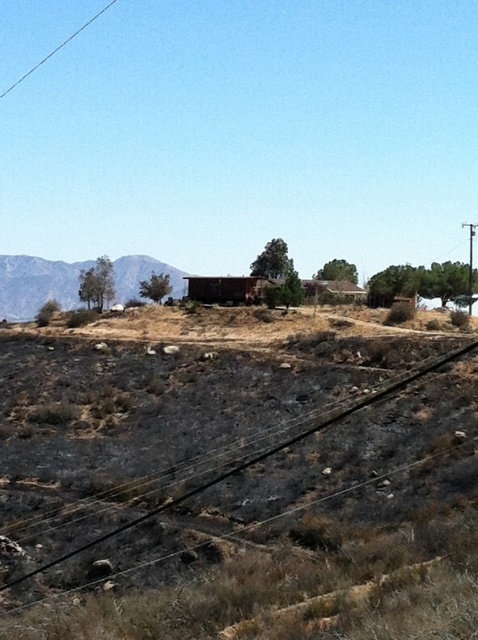
In the scene shown: You are a hiker planning to traverse the rugged brown mountain at left and the black asphalt train track at lower center. Which path would require more physical effort due to terrain difficulty?

The rugged brown mountain at left would require more physical effort because it has a larger size compared to the black asphalt train track at lower center, implying a more challenging terrain.